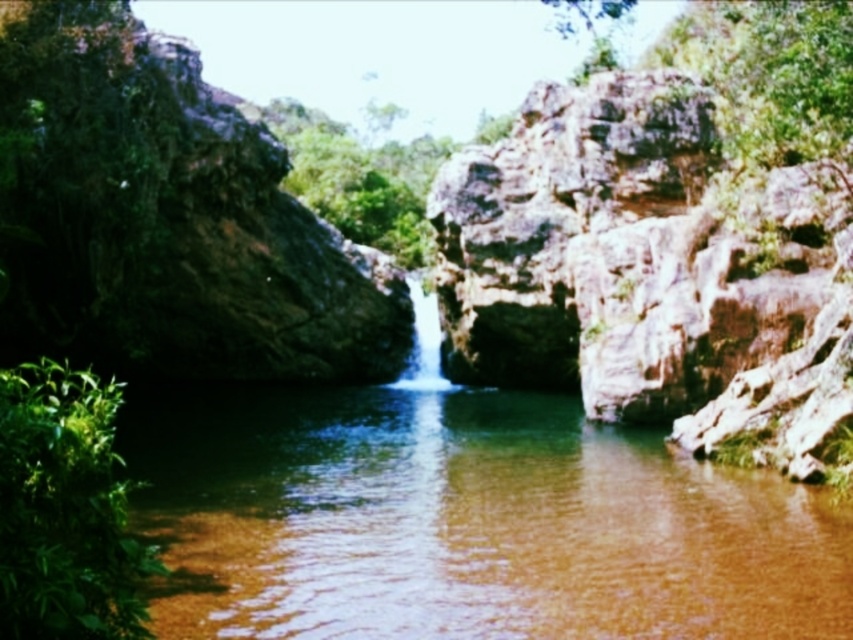
You are a photographer aiming to capture the entire view of the white smooth waterfall at center and the green leafy plant at lower left in one shot. Based on their sizes, which object would require you to adjust your camera angle more to ensure both are fully visible?

The green leafy plant at lower left is wider than the white smooth waterfall at center, so you would need to adjust your camera angle more to accommodate its larger width to ensure both are fully visible.